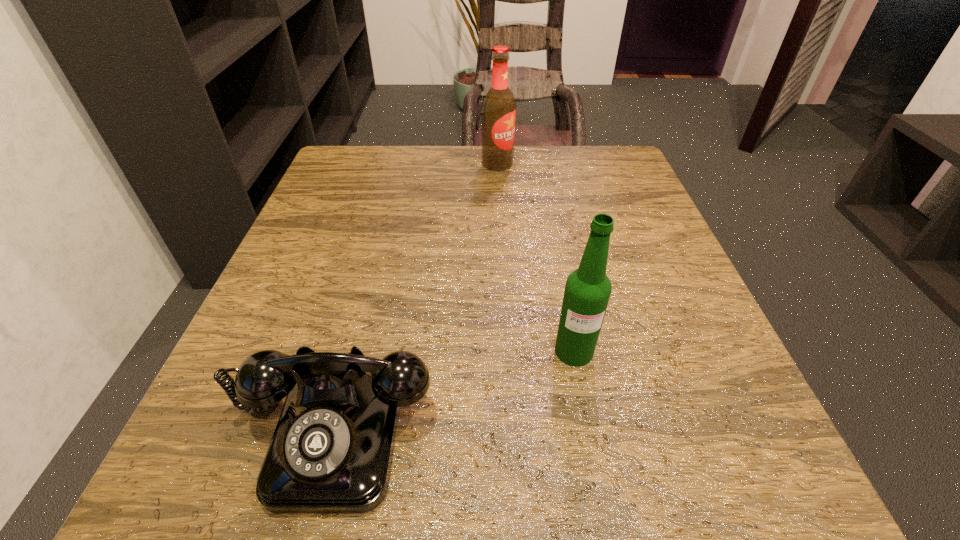
The image size is (960, 540). What are the coordinates of `the closest object to the farther beer bottle` in the screenshot? It's located at (587, 291).